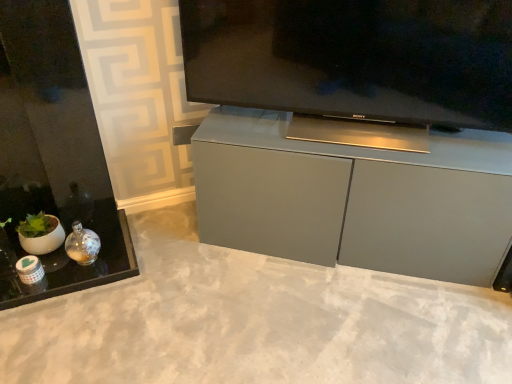
The height and width of the screenshot is (384, 512). I want to click on vacant region above matte gray cabinet at center (from a real-world perspective), so click(361, 134).